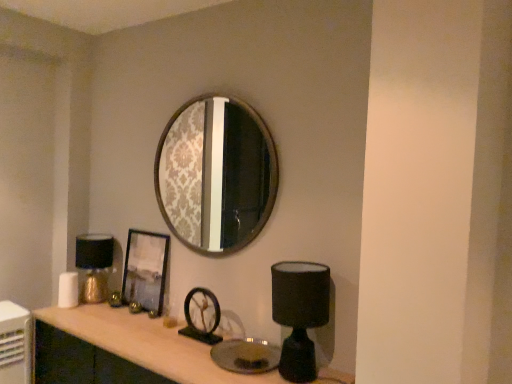
Locate an element on the screen. The height and width of the screenshot is (384, 512). vacant space to the left of metallic silver picture frame at center is located at coordinates (95, 315).